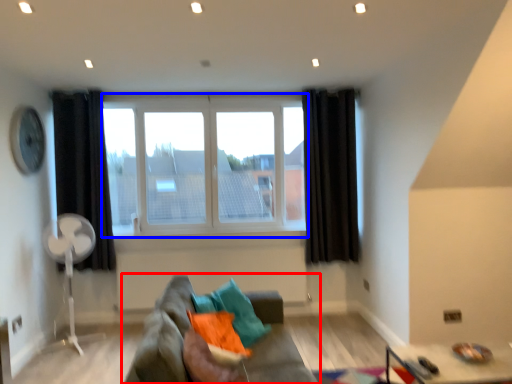
Question: Which object is further to the camera taking this photo, studio couch (highlighted by a red box) or window (highlighted by a blue box)?

Choices:
 (A) studio couch
 (B) window

Answer: (B)